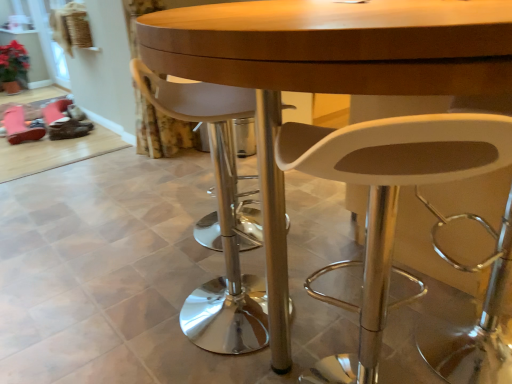
The width and height of the screenshot is (512, 384). I want to click on free space to the back side of white plastic stool at center, the second chair from the right, so click(x=219, y=255).